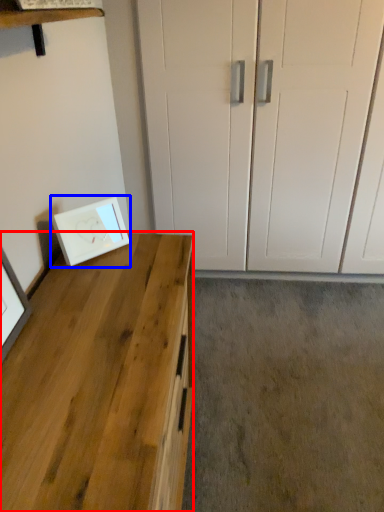
Question: Which object appears farthest to the camera in this image, desk (highlighted by a red box) or picture frame (highlighted by a blue box)?

Choices:
 (A) desk
 (B) picture frame

Answer: (B)